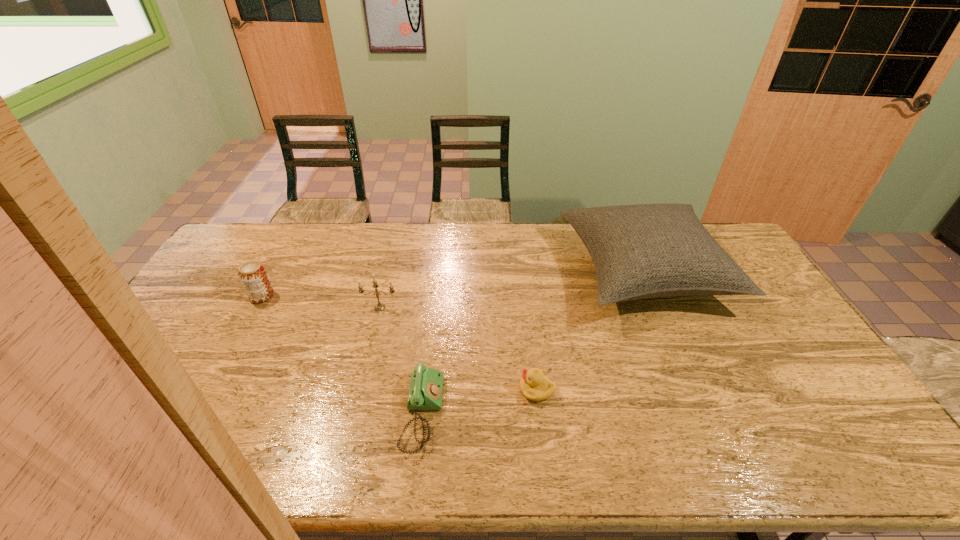
Identify the location of the tallest object. (641, 251).

The height and width of the screenshot is (540, 960). I want to click on cushion, so click(641, 251).

I want to click on candle, so click(379, 307).

At what (x,y) coordinates should I click in order to perform the action: click on beer can. Please return your answer as a coordinate pair (x, y). This screenshot has width=960, height=540. Looking at the image, I should click on (253, 276).

In order to click on duckling in this screenshot , I will do `click(534, 385)`.

This screenshot has width=960, height=540. Identify the location of the third object from left to right. tap(426, 384).

This screenshot has width=960, height=540. What are the coordinates of `free point located on the left of the cushion` in the screenshot? It's located at (485, 272).

Where is `vacant space situated on the left of the second object from left to right`? The image size is (960, 540). vacant space situated on the left of the second object from left to right is located at coordinates (319, 308).

Identify the location of free point located 0.190m on the left of the beer can. (193, 296).

Identify the location of free space located on the front-facing side of the duckling. (377, 389).